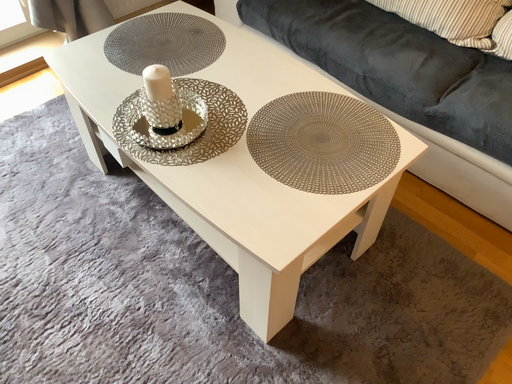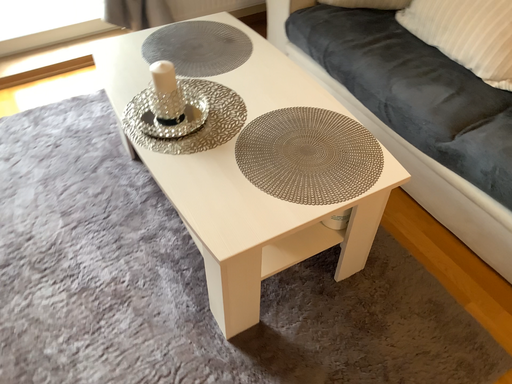
Question: Which way did the camera rotate in the video?

Choices:
 (A) rotated left
 (B) rotated right

Answer: (A)